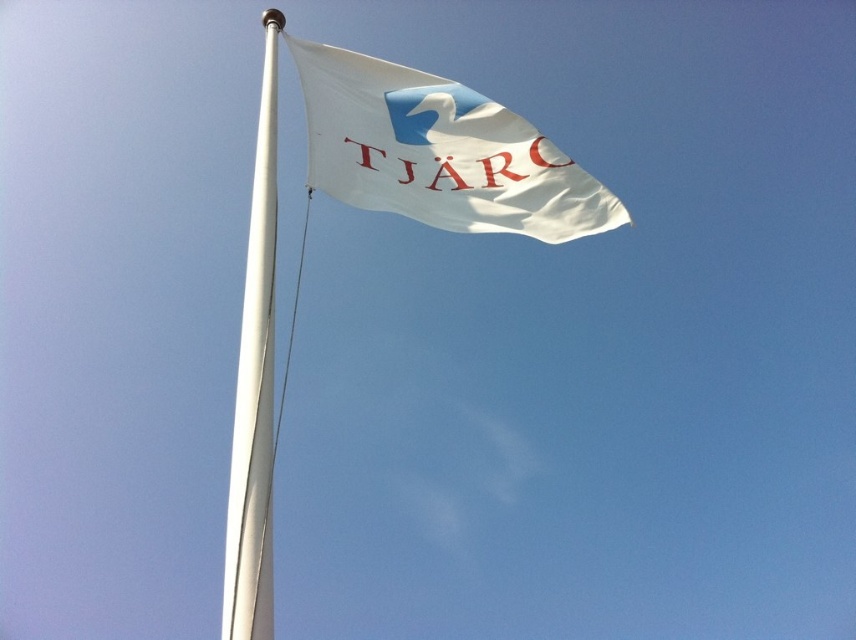
Question: Can you confirm if white fabric flag at upper center is smaller than white metallic pole at upper left?

Choices:
 (A) yes
 (B) no

Answer: (A)

Question: Is white fabric flag at upper center thinner than white metallic pole at upper left?

Choices:
 (A) no
 (B) yes

Answer: (B)

Question: Which of the following is the farthest from the observer?

Choices:
 (A) white fabric flag at upper center
 (B) white metallic pole at upper left

Answer: (A)

Question: Which object appears farthest from the camera in this image?

Choices:
 (A) white metallic pole at upper left
 (B) white fabric flag at upper center

Answer: (B)

Question: Does white fabric flag at upper center have a greater width compared to white metallic pole at upper left?

Choices:
 (A) no
 (B) yes

Answer: (A)

Question: Which of the following is the farthest from the observer?

Choices:
 (A) white metallic pole at upper left
 (B) white fabric flag at upper center

Answer: (B)